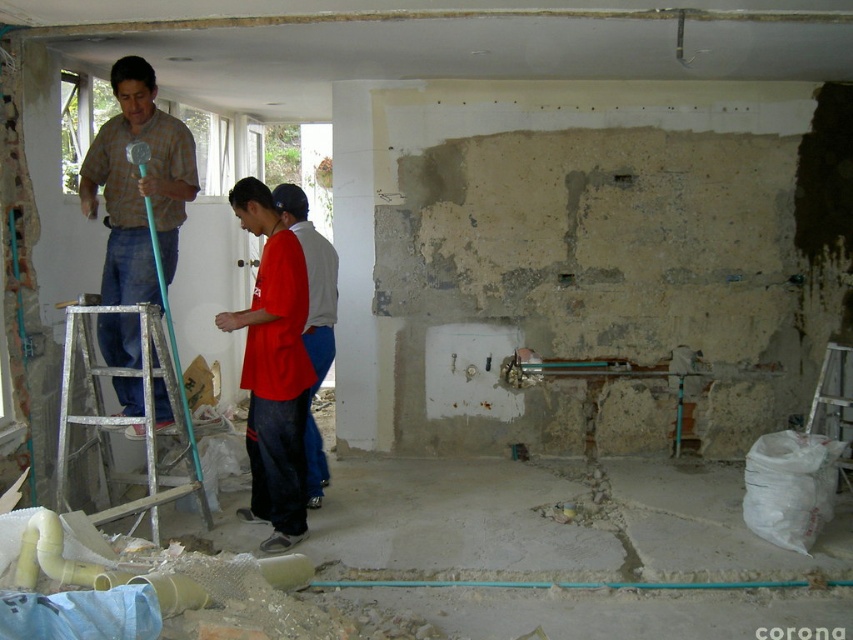
Consider the image. You are a safety inspector observing the construction site. You notice the matte red shirt at center and the white concrete pillar at center. Which object is closer to you, the inspector?

The matte red shirt at center is closer to you because it is in front of the white concrete pillar at center.

You are a construction worker needing to climb the silver metallic ladder at lower left to reach a high beam. However, you are wearing a red matte shirt at center. Could your shirt interfere with climbing the ladder safely?

The silver metallic ladder at lower left has a larger size compared to the red matte shirt at center. Since the ladder is larger, there should be enough space for the red matte shirt at center to climb safely without interference.

You are a safety inspector checking the construction site. You notice the matte red shirt at center and the white concrete pillar at center. Based on their positions, which object is more likely to be in the way of the workers moving through the center area?

The matte red shirt at center might be wider than the white concrete pillar at center, so it is more likely to be in the way of the workers moving through the center area.